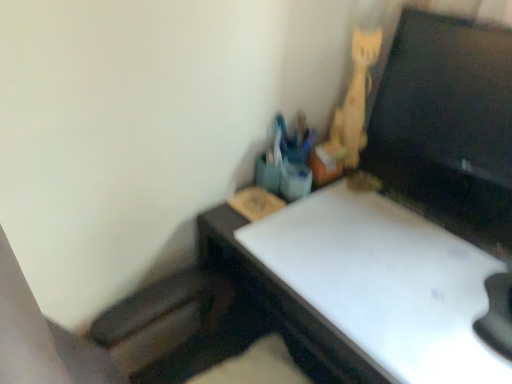
Question: Is the depth of wooden cat at upper right greater than that of black glossy monitor at upper right?

Choices:
 (A) no
 (B) yes

Answer: (B)

Question: Does wooden cat at upper right have a greater height compared to black glossy monitor at upper right?

Choices:
 (A) no
 (B) yes

Answer: (B)

Question: Does wooden cat at upper right have a larger size compared to black glossy monitor at upper right?

Choices:
 (A) yes
 (B) no

Answer: (B)

Question: Can you confirm if wooden cat at upper right is positioned to the right of black glossy monitor at upper right?

Choices:
 (A) yes
 (B) no

Answer: (B)

Question: From the image's perspective, is wooden cat at upper right on black glossy monitor at upper right?

Choices:
 (A) no
 (B) yes

Answer: (A)

Question: Considering the relative sizes of wooden cat at upper right and black glossy monitor at upper right in the image provided, is wooden cat at upper right wider than black glossy monitor at upper right?

Choices:
 (A) yes
 (B) no

Answer: (A)

Question: Considering the relative sizes of black glossy monitor at upper right and wooden cat at upper right in the image provided, is black glossy monitor at upper right wider than wooden cat at upper right?

Choices:
 (A) yes
 (B) no

Answer: (B)

Question: Does black glossy monitor at upper right turn towards wooden cat at upper right?

Choices:
 (A) no
 (B) yes

Answer: (B)

Question: Is black glossy monitor at upper right next to wooden cat at upper right and touching it?

Choices:
 (A) no
 (B) yes

Answer: (A)

Question: Is black glossy monitor at upper right to the right of wooden cat at upper right from the viewer's perspective?

Choices:
 (A) yes
 (B) no

Answer: (A)

Question: Considering the relative positions of black glossy monitor at upper right and wooden cat at upper right in the image provided, is black glossy monitor at upper right behind wooden cat at upper right?

Choices:
 (A) no
 (B) yes

Answer: (A)

Question: Does black glossy monitor at upper right have a lesser width compared to wooden cat at upper right?

Choices:
 (A) no
 (B) yes

Answer: (B)

Question: From the image's perspective, is black glossy monitor at upper right located above or below wooden cat at upper right?

Choices:
 (A) above
 (B) below

Answer: (A)